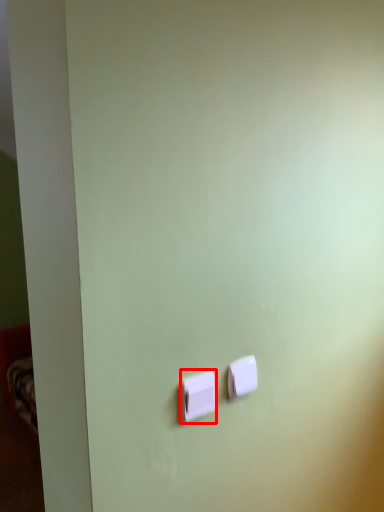
Question: From the image's perspective, where is light switch (annotated by the red box) located relative to light switch?

Choices:
 (A) above
 (B) below

Answer: (B)